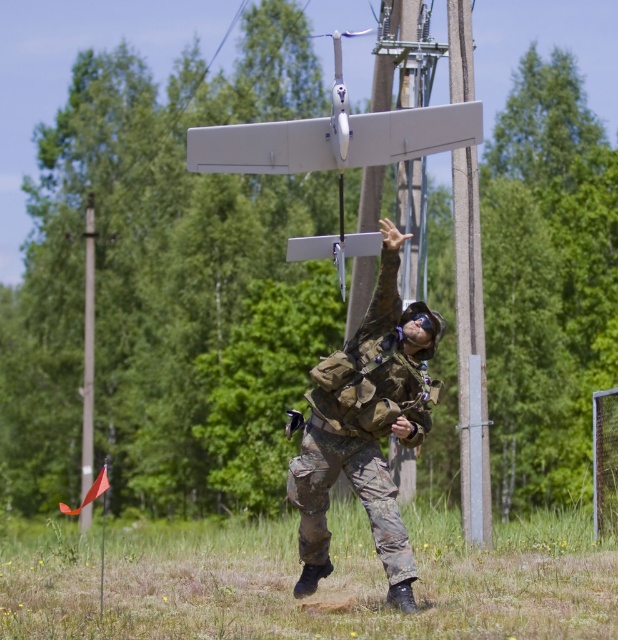
Does camouflage fabric uniform at center have a lesser width compared to smooth gray telegraph pole at center?

No, camouflage fabric uniform at center is not thinner than smooth gray telegraph pole at center.

Is camouflage fabric uniform at center shorter than smooth gray telegraph pole at center?

Yes, camouflage fabric uniform at center is shorter than smooth gray telegraph pole at center.

This screenshot has height=640, width=618. In order to click on camouflage fabric uniform at center in this screenshot , I will do `click(366, 426)`.